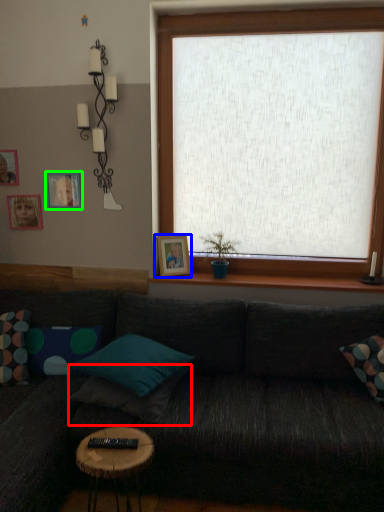
Question: Which is nearer to the pillow (highlighted by a red box)? picture frame (highlighted by a blue box) or picture frame (highlighted by a green box).

Choices:
 (A) picture frame
 (B) picture frame

Answer: (A)